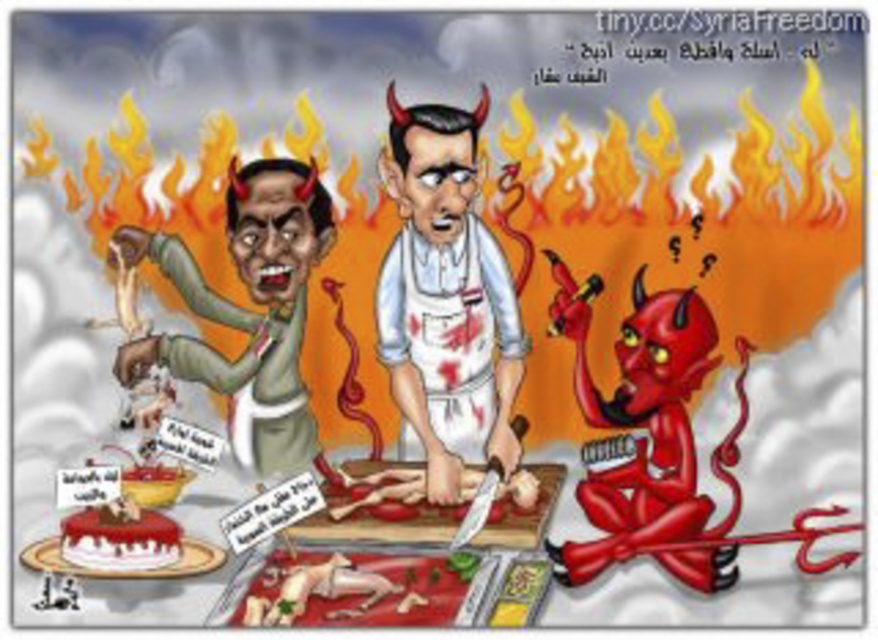
In the satirical cartoon, there are a green matte devil at left and a white frosted cake at lower left. Which of these two objects is positioned higher up in the image?

The green matte devil at left is located above the white frosted cake at lower left, so it is positioned higher up in the image.